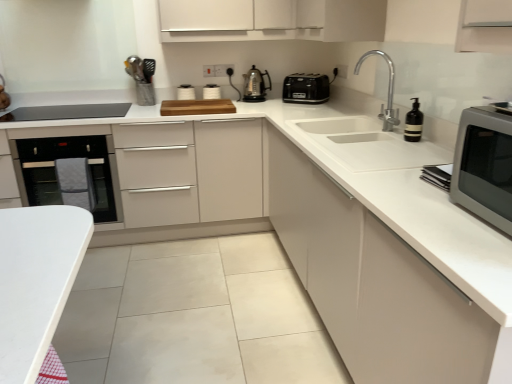
This screenshot has height=384, width=512. What do you see at coordinates (164, 168) in the screenshot?
I see `white matte cabinet at center, which ranks as the 3th cabinetry in right-to-left order` at bounding box center [164, 168].

In order to face polished chrome faucet at upper right, should I rotate leftwards or rightwards?

It's best to rotate right around 15.950 degrees.

Describe the element at coordinates (388, 91) in the screenshot. Image resolution: width=512 pixels, height=384 pixels. I see `polished chrome faucet at upper right` at that location.

What do you see at coordinates (484, 166) in the screenshot?
I see `matte gray microwave at right` at bounding box center [484, 166].

What is the approximate width of white matte cabinet at upper center, marked as the 2th cabinetry in a left-to-right arrangement?

The width of white matte cabinet at upper center, marked as the 2th cabinetry in a left-to-right arrangement, is 15.05 inches.

Image resolution: width=512 pixels, height=384 pixels. I want to click on white glossy toaster at upper center, so (x=185, y=92).

Find the location of a particular element. This screenshot has width=512, height=384. black plastic toaster at upper center, the 1th kitchen appliance in the right-to-left sequence is located at coordinates (306, 88).

From a real-world perspective, between white matte cabinet at center, the 1th cabinetry when ordered from left to right, and white matte cabinet at upper center, marked as the 2th cabinetry in a left-to-right arrangement, who is vertically lower?

white matte cabinet at center, the 1th cabinetry when ordered from left to right, is physically lower.

Is white matte cabinet at center, which ranks as the 3th cabinetry in right-to-left order, taller than white matte cabinet at upper center, the 2th cabinetry in the right-to-left sequence?

Indeed, white matte cabinet at center, which ranks as the 3th cabinetry in right-to-left order, has a greater height compared to white matte cabinet at upper center, the 2th cabinetry in the right-to-left sequence.

Which object is closer to the camera taking this photo, white matte cabinet at center, the 1th cabinetry when ordered from left to right, or white matte cabinet at upper center, marked as the 2th cabinetry in a left-to-right arrangement?

white matte cabinet at center, the 1th cabinetry when ordered from left to right, is more forward.

From the image's perspective, is white glossy toaster at upper center above matte gray microwave at right?

Yes, from the image's perspective, white glossy toaster at upper center is above matte gray microwave at right.

Where is `appliance lying above the matte gray microwave at right (from the image's perspective)`? appliance lying above the matte gray microwave at right (from the image's perspective) is located at coordinates (185, 92).

From a real-world perspective, is white glossy toaster at upper center below matte gray microwave at right?

Indeed, from a real-world perspective, white glossy toaster at upper center is positioned beneath matte gray microwave at right.

Who is taller, white glossy toaster at upper center or matte gray microwave at right?

matte gray microwave at right is taller.

Could you tell me if white glossy toaster at upper center is turned towards white matte cabinet at upper center, marked as the 2th cabinetry in a left-to-right arrangement?

No, white glossy toaster at upper center does not turn towards white matte cabinet at upper center, marked as the 2th cabinetry in a left-to-right arrangement.

From the image's perspective, would you say white glossy toaster at upper center is positioned over white matte cabinet at upper center, the 2th cabinetry in the right-to-left sequence?

No, from the image's perspective, white glossy toaster at upper center is not above white matte cabinet at upper center, the 2th cabinetry in the right-to-left sequence.

Find the location of a particular element. appliance to the left of white matte cabinet at upper center, the 2th cabinetry in the right-to-left sequence is located at coordinates (185, 92).

Is white glossy toaster at upper center spatially inside white matte cabinet at upper center, the 2th cabinetry in the right-to-left sequence, or outside of it?

white glossy toaster at upper center cannot be found inside white matte cabinet at upper center, the 2th cabinetry in the right-to-left sequence.

Is matte gray microwave at right thinner than black glass oven at left?

Indeed, matte gray microwave at right has a lesser width compared to black glass oven at left.

Based on their positions, is matte gray microwave at right located to the left or right of black glass oven at left?

Clearly, matte gray microwave at right is on the right of black glass oven at left in the image.

From the image's perspective, which object appears higher, matte gray microwave at right or black glass oven at left?

black glass oven at left, from the image's perspective.

Can you confirm if white matte cabinet at upper center, marked as the 2th cabinetry in a left-to-right arrangement, is bigger than satin nickel kettle at center, the second kitchen appliance from the right?

Correct, white matte cabinet at upper center, marked as the 2th cabinetry in a left-to-right arrangement, is larger in size than satin nickel kettle at center, the second kitchen appliance from the right.

From the image's perspective, which is below, white matte cabinet at upper center, the 2th cabinetry in the right-to-left sequence, or satin nickel kettle at center, acting as the 1th kitchen appliance starting from the left?

From the image's view, satin nickel kettle at center, acting as the 1th kitchen appliance starting from the left, is below.

Which of these two, white matte cabinet at upper center, marked as the 2th cabinetry in a left-to-right arrangement, or satin nickel kettle at center, the second kitchen appliance from the right, is wider?

white matte cabinet at upper center, marked as the 2th cabinetry in a left-to-right arrangement, is wider.

Which is more to the right, white matte cabinet at upper center, the 2th cabinetry in the right-to-left sequence, or satin nickel kettle at center, acting as the 1th kitchen appliance starting from the left?

satin nickel kettle at center, acting as the 1th kitchen appliance starting from the left, is more to the right.

Who is smaller, black glass oven at left or matte gray microwave at right?

With smaller size is matte gray microwave at right.

Considering the sizes of objects black glass oven at left and matte gray microwave at right in the image provided, who is taller, black glass oven at left or matte gray microwave at right?

black glass oven at left.

Is black glass oven at left to the right of matte gray microwave at right from the viewer's perspective?

No, black glass oven at left is not to the right of matte gray microwave at right.

Is white matte cabinet at center, which appears as the first cabinetry when viewed from the right, located outside matte gray microwave at right?

white matte cabinet at center, which appears as the first cabinetry when viewed from the right, is positioned outside matte gray microwave at right.

Where is `cabinetry located below the matte gray microwave at right (from the image's perspective)`? Image resolution: width=512 pixels, height=384 pixels. cabinetry located below the matte gray microwave at right (from the image's perspective) is located at coordinates coord(374,283).

Which is in front, white matte cabinet at center, marked as the third cabinetry in a left-to-right arrangement, or matte gray microwave at right?

Positioned in front is white matte cabinet at center, marked as the third cabinetry in a left-to-right arrangement.

Could you tell me if white matte cabinet at center, marked as the third cabinetry in a left-to-right arrangement, is facing matte gray microwave at right?

No, white matte cabinet at center, marked as the third cabinetry in a left-to-right arrangement, does not turn towards matte gray microwave at right.

Where is `cabinetry that appears behind the white matte cabinet at center, the 1th cabinetry when ordered from left to right`? Image resolution: width=512 pixels, height=384 pixels. cabinetry that appears behind the white matte cabinet at center, the 1th cabinetry when ordered from left to right is located at coordinates (272, 20).

Identify the location of appliance above the matte gray microwave at right (from the image's perspective). (185, 92).

Considering their positions, is black plastic toaster at upper center, the 1th kitchen appliance in the right-to-left sequence, positioned closer to white glossy toaster at upper center than white matte cabinet at center, marked as the third cabinetry in a left-to-right arrangement?

black plastic toaster at upper center, the 1th kitchen appliance in the right-to-left sequence, is positioned closer to the anchor white glossy toaster at upper center.

Based on their spatial positions, is black glass oven at left or satin nickel kettle at center, the second kitchen appliance from the right, closer to white matte cabinet at center, which ranks as the 3th cabinetry in right-to-left order?

Based on the image, black glass oven at left appears to be nearer to white matte cabinet at center, which ranks as the 3th cabinetry in right-to-left order.

Looking at the image, which one is located further to matte gray microwave at right, satin nickel kettle at center, the second kitchen appliance from the right, or black plastic toaster at upper center, which ranks as the 2th kitchen appliance in left-to-right order?

satin nickel kettle at center, the second kitchen appliance from the right, is further to matte gray microwave at right.

Based on their spatial positions, is polished chrome faucet at upper right or satin nickel kettle at center, the second kitchen appliance from the right, closer to white matte cabinet at upper center, marked as the 2th cabinetry in a left-to-right arrangement?

Based on the image, satin nickel kettle at center, the second kitchen appliance from the right, appears to be nearer to white matte cabinet at upper center, marked as the 2th cabinetry in a left-to-right arrangement.

From the image, which object appears to be nearer to satin nickel kettle at center, acting as the 1th kitchen appliance starting from the left, white matte cabinet at center, the 1th cabinetry when ordered from left to right, or white glossy toaster at upper center?

white glossy toaster at upper center is closer to satin nickel kettle at center, acting as the 1th kitchen appliance starting from the left.

From the image, which object appears to be farther from white matte cabinet at center, marked as the third cabinetry in a left-to-right arrangement, white matte cabinet at center, which ranks as the 3th cabinetry in right-to-left order, or matte gray microwave at right?

The object further to white matte cabinet at center, marked as the third cabinetry in a left-to-right arrangement, is white matte cabinet at center, which ranks as the 3th cabinetry in right-to-left order.

Based on their spatial positions, is white matte cabinet at center, which ranks as the 3th cabinetry in right-to-left order, or white glossy toaster at upper center further from white matte cabinet at center, which appears as the first cabinetry when viewed from the right?

white glossy toaster at upper center is further to white matte cabinet at center, which appears as the first cabinetry when viewed from the right.

Which object lies further to the anchor point white matte cabinet at upper center, the 2th cabinetry in the right-to-left sequence, black plastic toaster at upper center, which ranks as the 2th kitchen appliance in left-to-right order, or polished chrome faucet at upper right?

Among the two, polished chrome faucet at upper right is located further to white matte cabinet at upper center, the 2th cabinetry in the right-to-left sequence.

This screenshot has width=512, height=384. Find the location of `kitchen appliance between white matte cabinet at center, marked as the third cabinetry in a left-to-right arrangement, and satin nickel kettle at center, acting as the 1th kitchen appliance starting from the left, from front to back`. kitchen appliance between white matte cabinet at center, marked as the third cabinetry in a left-to-right arrangement, and satin nickel kettle at center, acting as the 1th kitchen appliance starting from the left, from front to back is located at coordinates (306, 88).

The width and height of the screenshot is (512, 384). Identify the location of oven located between white matte cabinet at center, marked as the third cabinetry in a left-to-right arrangement, and satin nickel kettle at center, acting as the 1th kitchen appliance starting from the left, in the depth direction. pyautogui.click(x=56, y=172).

Locate an element on the screen. The image size is (512, 384). home appliance between white matte cabinet at center, marked as the third cabinetry in a left-to-right arrangement, and white glossy toaster at upper center, along the z-axis is located at coordinates (484, 166).

Where is `tap between matte gray microwave at right and white glossy toaster at upper center from front to back`? tap between matte gray microwave at right and white glossy toaster at upper center from front to back is located at coordinates (388, 91).